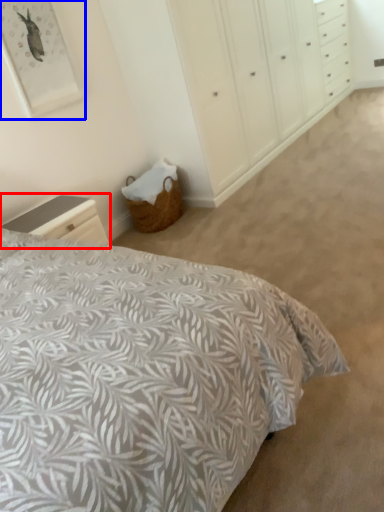
Question: Which point is further to the camera, nightstand (highlighted by a red box) or picture frame (highlighted by a blue box)?

Choices:
 (A) nightstand
 (B) picture frame

Answer: (B)